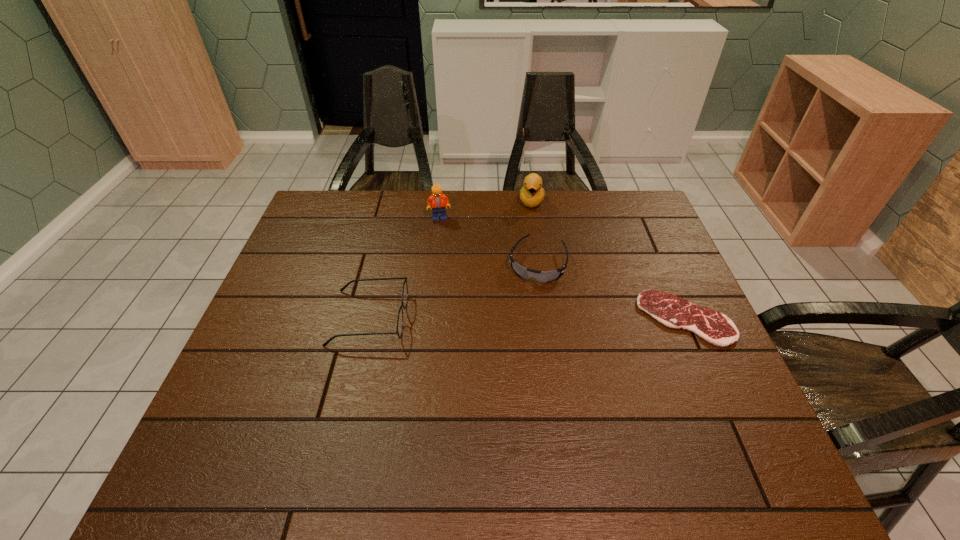
The width and height of the screenshot is (960, 540). I want to click on vacant space on the desktop that is between the spectacles and the rightmost object and is positioned on the front-facing side of the second farthest object, so click(518, 318).

Locate an element on the screen. The height and width of the screenshot is (540, 960). vacant space on the desktop that is between the third shortest object and the shortest object and is positioned on the lenses of the fourth tallest object is located at coordinates pos(521,318).

Locate an element on the screen. The height and width of the screenshot is (540, 960). free spot on the desktop that is between the spectacles and the rightmost object and is positioned facing forward on the duckling is located at coordinates (520, 318).